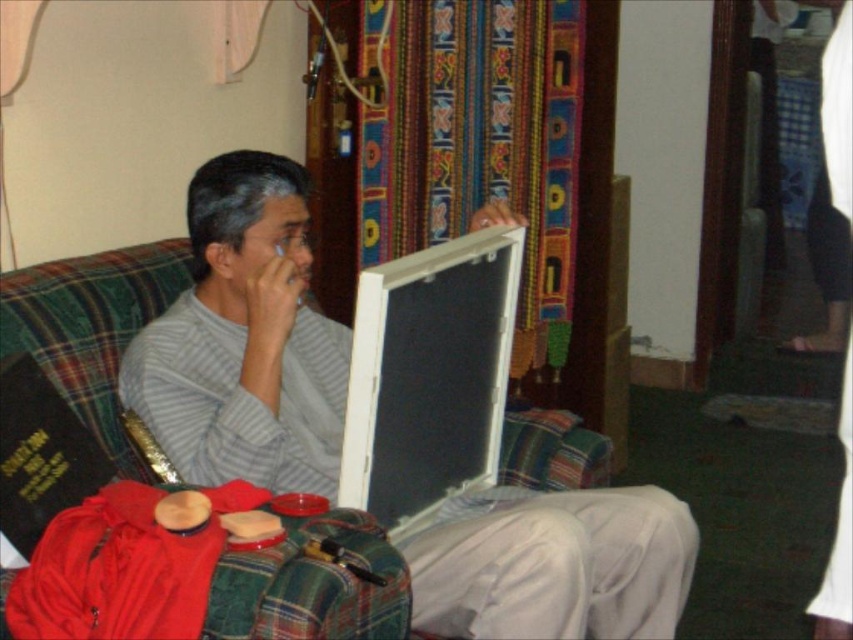
Question: Which point is farther to the camera?

Choices:
 (A) gray striped shirt at center
 (B) white plastic laptop at center

Answer: (B)

Question: Can you confirm if gray striped shirt at center is positioned below white plastic laptop at center?

Choices:
 (A) no
 (B) yes

Answer: (B)

Question: Considering the relative positions of gray striped shirt at center and white plastic laptop at center in the image provided, where is gray striped shirt at center located with respect to white plastic laptop at center?

Choices:
 (A) below
 (B) above

Answer: (A)

Question: Which object is closer to the camera taking this photo?

Choices:
 (A) gray striped shirt at center
 (B) white plastic laptop at center

Answer: (A)

Question: Is gray striped shirt at center below white plastic laptop at center?

Choices:
 (A) yes
 (B) no

Answer: (A)